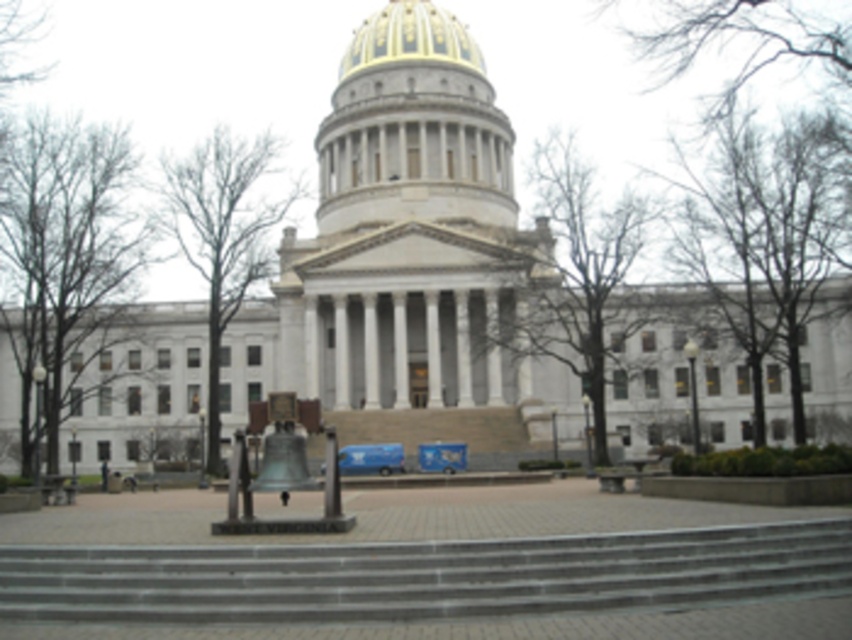
Question: Which object appears farthest from the camera in this image?

Choices:
 (A) green leafless tree at center
 (B) gold plated dome at center

Answer: (B)

Question: Does brown leafless tree at right appear under bare branches at center?

Choices:
 (A) yes
 (B) no

Answer: (A)

Question: Can you confirm if brown leafless tree at left is positioned to the left of gold plated dome at center?

Choices:
 (A) yes
 (B) no

Answer: (A)

Question: Which object is farther from the camera taking this photo?

Choices:
 (A) smooth brown bark at left
 (B) green leafless tree at center
 (C) brown leafless tree at right

Answer: (A)

Question: Can you confirm if gray concrete stairs at center is positioned to the right of brown leafless tree at right?

Choices:
 (A) yes
 (B) no

Answer: (B)

Question: Which point is farther to the camera?

Choices:
 (A) bare branches at center
 (B) smooth brown bark at left

Answer: (B)